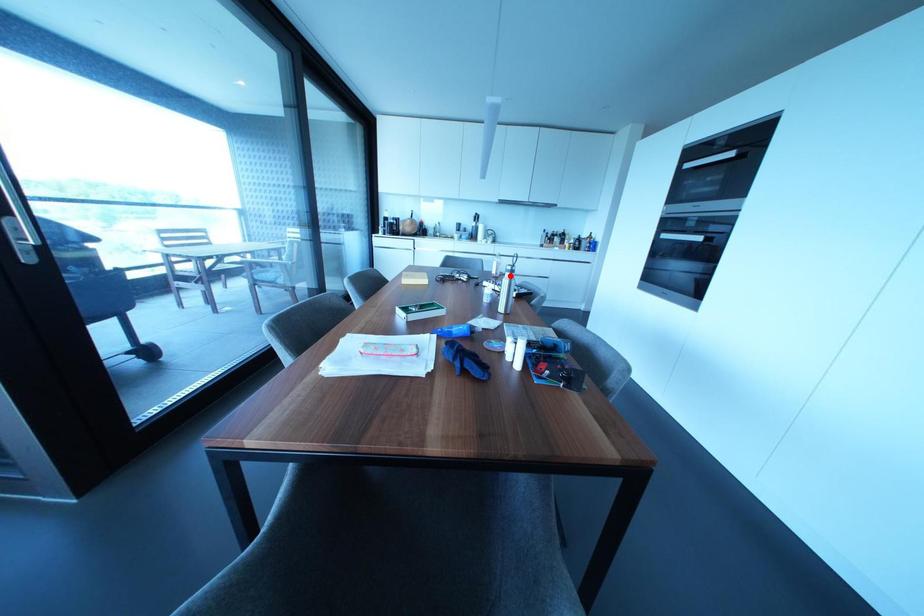
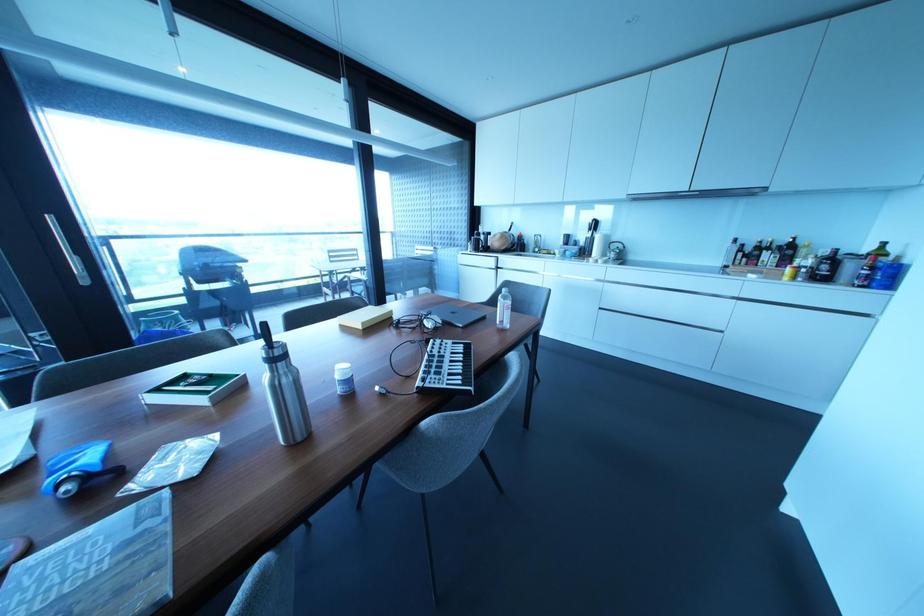
Question: I am providing you with two images of the same scene from different viewpoints. In image1, a red point is highlighted. Considering the same 3D point in image2, which of the following is correct?

Choices:
 (A) It is closer
 (B) It is farther

Answer: (B)